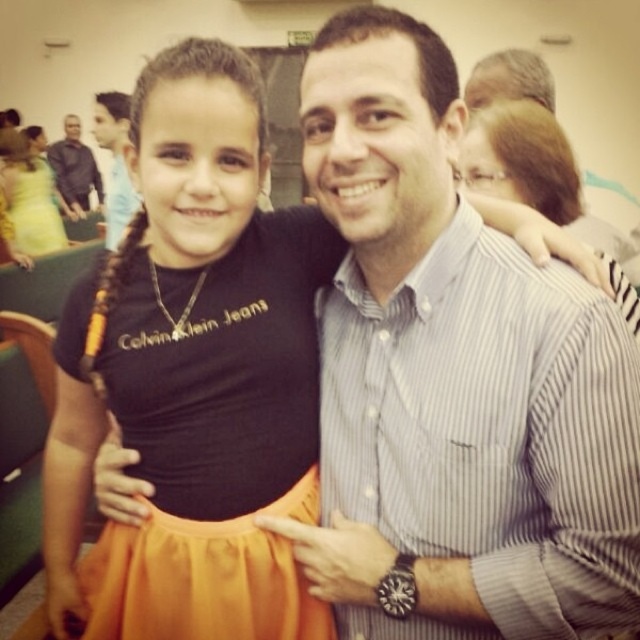
What is located at the coordinates point (509, 80)?

At point (509, 80) is the striped shirt at upper right.

You are organizing a fashion show and need to decide which outfit takes more space on the runway. Based on the image, which one between the striped cotton shirt at center and the orange satin dress at center requires more space?

The orange satin dress at center requires more space because its width is greater than the striped cotton shirt at center.